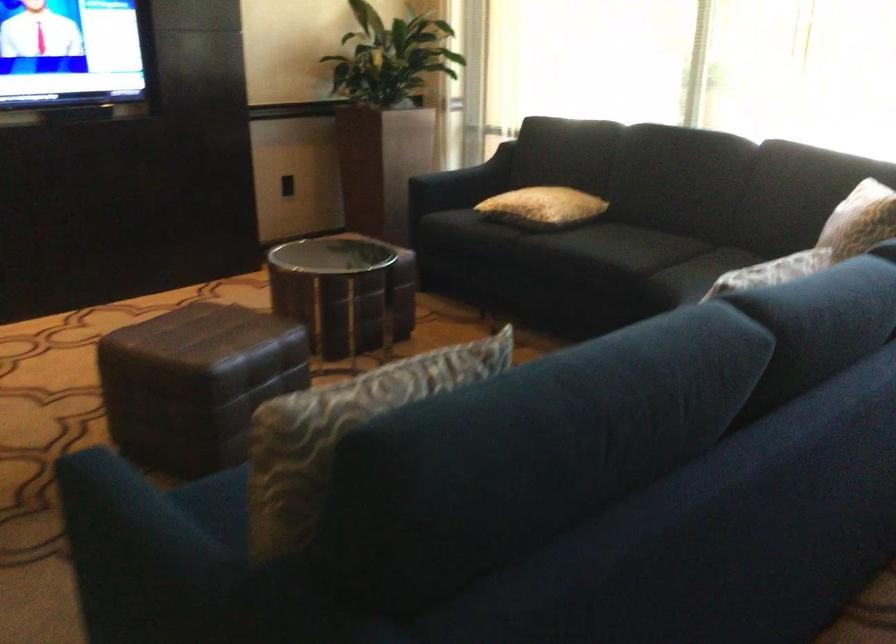
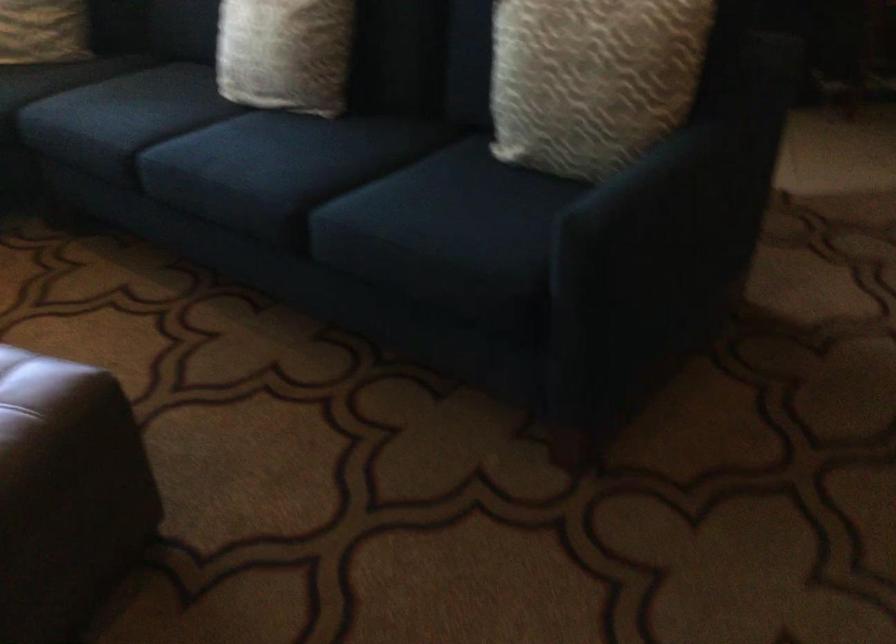
In the second image, find the point that corresponds to pixel 308 446 in the first image.

(591, 80)